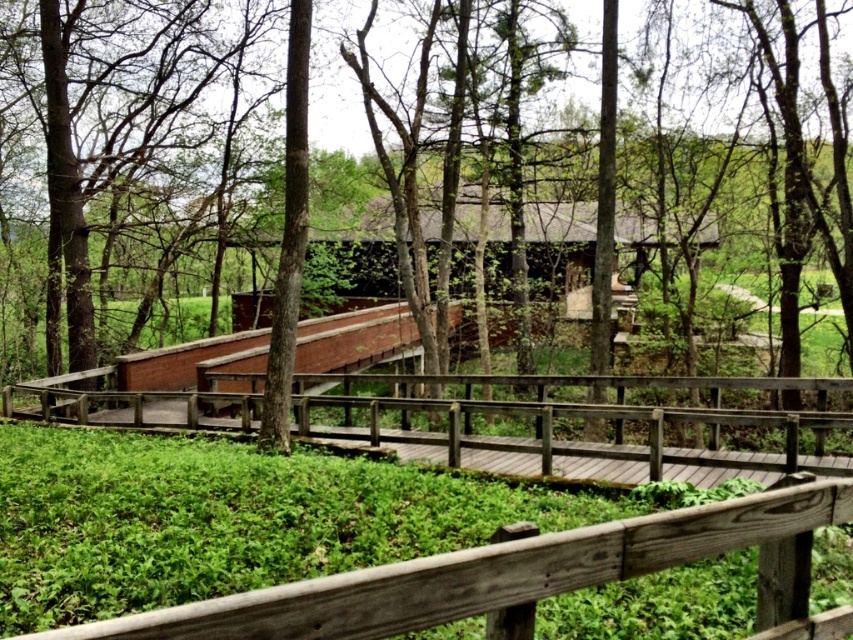
You are standing at the starting point of the wooden bridge at center and want to reach the brown wood tree at center. Which direction should you walk to get closer to the tree?

You should walk away from the wooden bridge at center towards the brown wood tree at center since the bridge is in front of the tree, meaning the tree is behind the bridge from your current position.

You are planning to build a new wooden structure in the same area as the wooden bridge at center and the brown wood tree at center. Based on their sizes, which one would require more space for construction?

The brown wood tree at center requires more space for construction because it occupies more space than the wooden bridge at center.